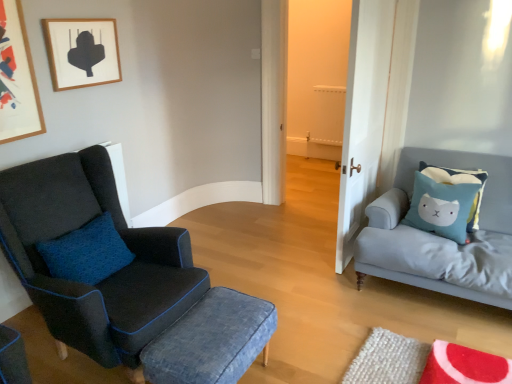
This screenshot has height=384, width=512. What are the coordinates of `free space above denim fabric stool at center (from a real-world perspective)` in the screenshot? It's located at (207, 329).